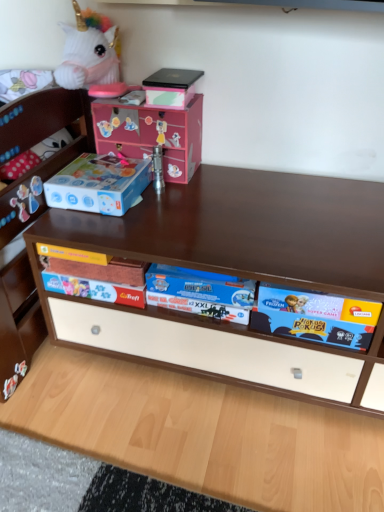
Question: Could you tell me if pink cardboard box at upper center is facing matte black box at upper center?

Choices:
 (A) no
 (B) yes

Answer: (A)

Question: From the image's perspective, is pink cardboard box at upper center beneath matte black box at upper center?

Choices:
 (A) no
 (B) yes

Answer: (B)

Question: From a real-world perspective, is pink cardboard box at upper center physically below matte black box at upper center?

Choices:
 (A) yes
 (B) no

Answer: (A)

Question: Does pink cardboard box at upper center appear on the left side of matte black box at upper center?

Choices:
 (A) yes
 (B) no

Answer: (A)

Question: Does pink cardboard box at upper center come behind matte black box at upper center?

Choices:
 (A) no
 (B) yes

Answer: (B)

Question: From a real-world perspective, is pink cardboard box at upper center over matte black box at upper center?

Choices:
 (A) yes
 (B) no

Answer: (B)

Question: From the image's perspective, does pink cardboard box at upper center appear lower than blue cardboard game box at center?

Choices:
 (A) yes
 (B) no

Answer: (B)

Question: Could you tell me if pink cardboard box at upper center is facing blue cardboard game box at center?

Choices:
 (A) yes
 (B) no

Answer: (B)

Question: Is blue cardboard game box at center inside pink cardboard box at upper center?

Choices:
 (A) yes
 (B) no

Answer: (B)

Question: Is pink cardboard box at upper center positioned before blue cardboard game box at center?

Choices:
 (A) yes
 (B) no

Answer: (B)

Question: Is pink cardboard box at upper center located outside blue cardboard game box at center?

Choices:
 (A) no
 (B) yes

Answer: (B)

Question: Does pink cardboard box at upper center appear on the right side of blue cardboard game box at center?

Choices:
 (A) no
 (B) yes

Answer: (A)

Question: Can we say matte black box at upper center lies outside blue cardboard storage box at left?

Choices:
 (A) no
 (B) yes

Answer: (B)